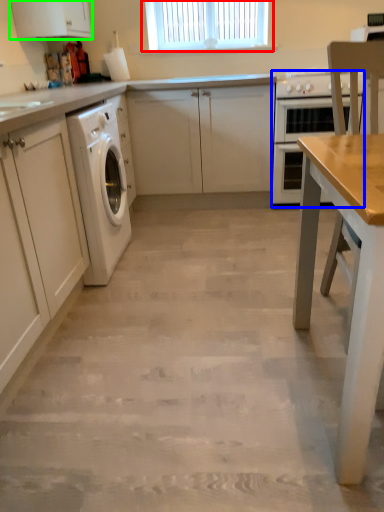
Question: Estimate the real-world distances between objects in this image. Which object is farther from window (highlighted by a red box), home appliance (highlighted by a blue box) or cabinetry (highlighted by a green box)?

Choices:
 (A) home appliance
 (B) cabinetry

Answer: (B)